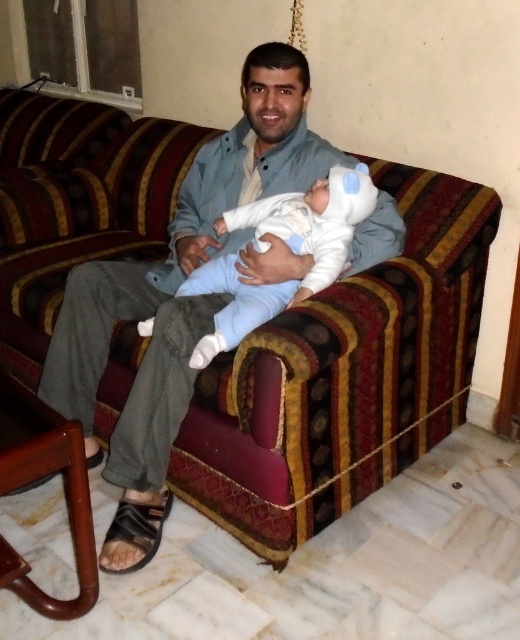
Question: Does light blue denim shirt at center have a lesser width compared to white soft baby at center?

Choices:
 (A) no
 (B) yes

Answer: (A)

Question: Can you confirm if light blue denim shirt at center is smaller than white soft baby at center?

Choices:
 (A) no
 (B) yes

Answer: (A)

Question: Does light blue denim shirt at center have a larger size compared to white soft baby at center?

Choices:
 (A) no
 (B) yes

Answer: (B)

Question: Which point appears closest to the camera in this image?

Choices:
 (A) (254, 138)
 (B) (289, 193)

Answer: (B)

Question: Which of the following is the farthest from the observer?

Choices:
 (A) (123, 500)
 (B) (236, 324)

Answer: (A)

Question: Which point is farther to the camera?

Choices:
 (A) (234, 256)
 (B) (353, 246)

Answer: (A)